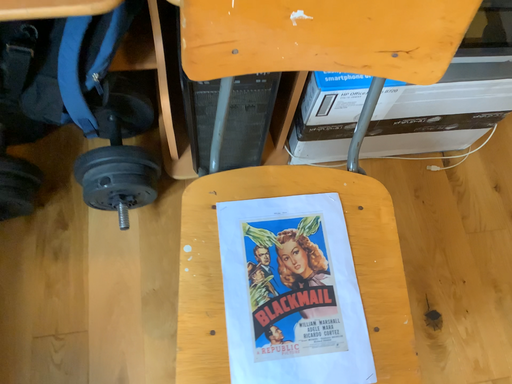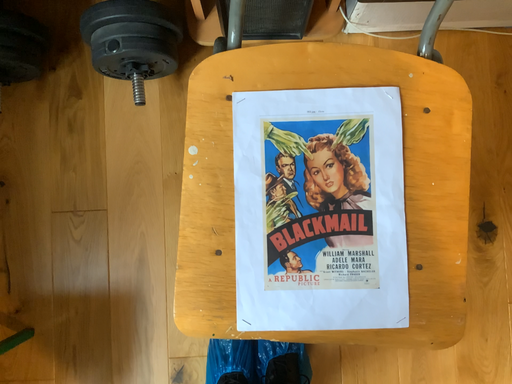
Question: Which way did the camera rotate in the video?

Choices:
 (A) rotated downward
 (B) rotated upward

Answer: (A)